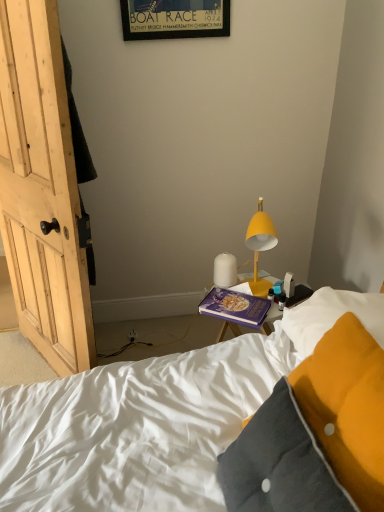
Question: Is the position of purple matte book at center less distant than that of velvet yellow pillow at lower right?

Choices:
 (A) yes
 (B) no

Answer: (B)

Question: From a real-world perspective, is purple matte book at center on top of velvet yellow pillow at lower right?

Choices:
 (A) yes
 (B) no

Answer: (B)

Question: Is purple matte book at center taller than velvet yellow pillow at lower right?

Choices:
 (A) no
 (B) yes

Answer: (A)

Question: Considering the relative sizes of purple matte book at center and velvet yellow pillow at lower right in the image provided, is purple matte book at center thinner than velvet yellow pillow at lower right?

Choices:
 (A) yes
 (B) no

Answer: (A)

Question: Is purple matte book at center facing towards velvet yellow pillow at lower right?

Choices:
 (A) no
 (B) yes

Answer: (B)

Question: Can we say purple matte book at center lies outside velvet yellow pillow at lower right?

Choices:
 (A) yes
 (B) no

Answer: (A)

Question: Is white matte lamp at center, marked as the 1th lamp in a left-to-right arrangement, at the right side of yellow matte lamp at upper right, arranged as the first lamp when viewed from the right?

Choices:
 (A) no
 (B) yes

Answer: (A)

Question: Is white matte lamp at center, marked as the 1th lamp in a left-to-right arrangement, outside yellow matte lamp at upper right, arranged as the 2th lamp when viewed from the left?

Choices:
 (A) no
 (B) yes

Answer: (B)

Question: Is white matte lamp at center, marked as the 1th lamp in a left-to-right arrangement, turned away from yellow matte lamp at upper right, arranged as the 2th lamp when viewed from the left?

Choices:
 (A) no
 (B) yes

Answer: (A)

Question: Does white matte lamp at center, which is counted as the 2th lamp, starting from the right, have a greater height compared to yellow matte lamp at upper right, arranged as the first lamp when viewed from the right?

Choices:
 (A) yes
 (B) no

Answer: (B)

Question: From the image's perspective, is white matte lamp at center, which is counted as the 2th lamp, starting from the right, on top of yellow matte lamp at upper right, arranged as the 2th lamp when viewed from the left?

Choices:
 (A) yes
 (B) no

Answer: (B)

Question: From a real-world perspective, is white matte lamp at center, marked as the 1th lamp in a left-to-right arrangement, located beneath yellow matte lamp at upper right, arranged as the first lamp when viewed from the right?

Choices:
 (A) no
 (B) yes

Answer: (B)

Question: Can you confirm if purple matte book at center is thinner than wooden framed poster at upper center?

Choices:
 (A) no
 (B) yes

Answer: (A)